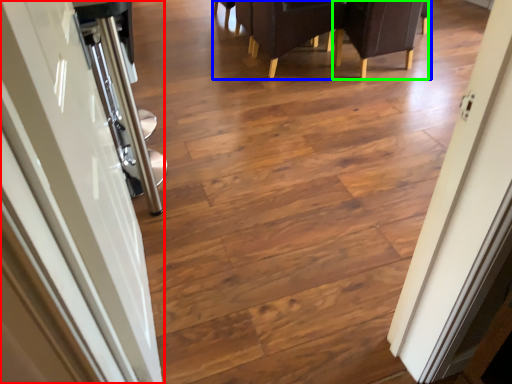
Question: Estimate the real-world distances between objects in this image. Which object is farther from door (highlighted by a red box), furniture (highlighted by a blue box) or armchair (highlighted by a green box)?

Choices:
 (A) furniture
 (B) armchair

Answer: (B)